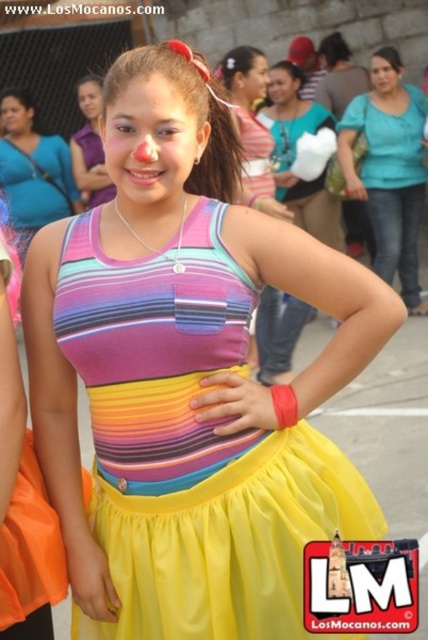
Question: Among these points, which one is nearest to the camera?

Choices:
 (A) (290, 74)
 (B) (372, 90)
 (C) (244, 88)

Answer: (C)

Question: Is multicolored fabric dress at center behind matte skin face at upper center?

Choices:
 (A) yes
 (B) no

Answer: (B)

Question: Which object is positioned closest to the matte black face at upper left?

Choices:
 (A) multicolored fabric dress at center
 (B) smooth skin face at center

Answer: (B)

Question: Can you confirm if multicolored fabric dress at center is positioned to the right of matte black face at upper left?

Choices:
 (A) yes
 (B) no

Answer: (A)

Question: Which point appears farthest from the camera in this image?

Choices:
 (A) [x=136, y=77]
 (B) [x=23, y=116]
 (C) [x=228, y=572]
 (D) [x=382, y=76]

Answer: (B)

Question: Is matte black face at center wider than matte black face at upper left?

Choices:
 (A) yes
 (B) no

Answer: (A)